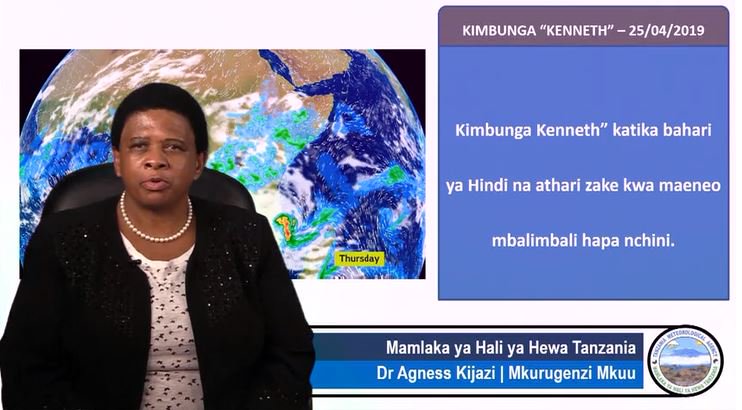
Locate an element on the screen. The image size is (742, 410). soft backed chair is located at coordinates (104, 187), (222, 195).